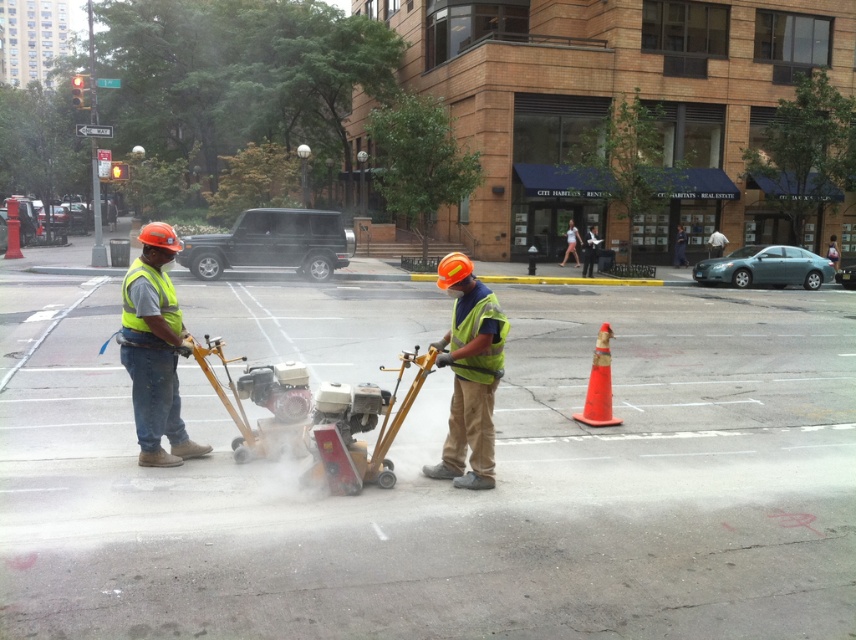
Question: Which object appears farthest from the camera in this image?

Choices:
 (A) reflective yellow vest at left
 (B) yellow reflective safety vest at center
 (C) orange matte traffic cone at center-right

Answer: (C)

Question: Does yellow reflective safety vest at center have a lesser width compared to high-visibility yellow-green safety vest at left?

Choices:
 (A) no
 (B) yes

Answer: (B)

Question: In this image, where is reflective yellow vest at left located relative to high-visibility yellow-green safety vest at left?

Choices:
 (A) above
 (B) below

Answer: (B)

Question: Considering the real-world distances, which object is farthest from the reflective yellow vest at center?

Choices:
 (A) high-visibility yellow-green safety vest at left
 (B) reflective yellow vest at left
 (C) yellow reflective safety vest at center

Answer: (A)

Question: Which point is farther to the camera?

Choices:
 (A) (492, 380)
 (B) (452, 442)
 (C) (165, 307)
 (D) (152, 273)

Answer: (C)

Question: Is high-visibility yellow-green safety vest at left above orange matte traffic cone at center-right?

Choices:
 (A) yes
 (B) no

Answer: (A)